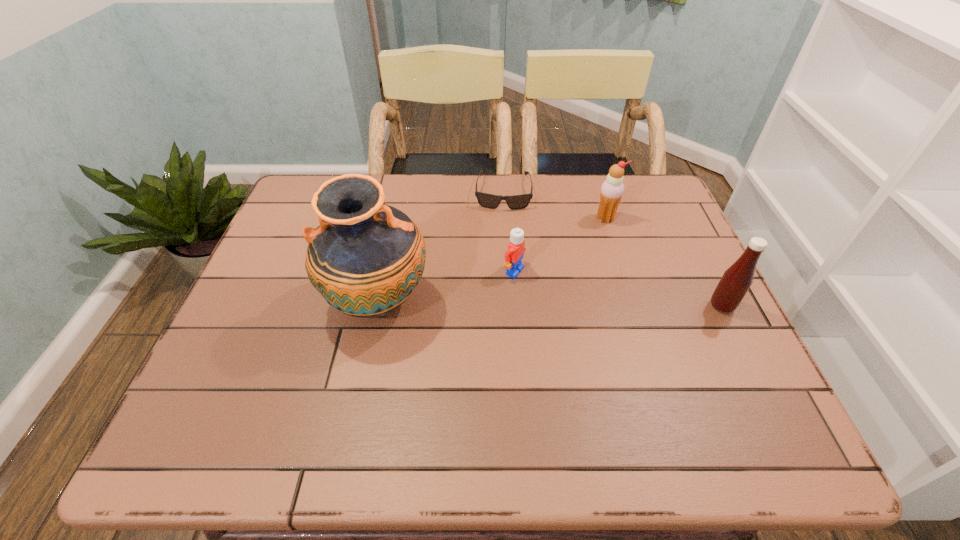
Locate an element on the screen. This screenshot has height=540, width=960. free location located 0.190m at the front with a straw on the second farthest object is located at coordinates (601, 270).

Where is `vacant space located at the front with a straw on the second farthest object`? vacant space located at the front with a straw on the second farthest object is located at coordinates (597, 314).

What are the coordinates of `vacant space positioned at the front with a straw on the second farthest object` in the screenshot? It's located at click(x=603, y=250).

Find the location of `vacant area situated 0.320m on the face of the Lego`. vacant area situated 0.320m on the face of the Lego is located at coordinates (648, 330).

Locate an element on the screen. The height and width of the screenshot is (540, 960). free space located on the face of the Lego is located at coordinates (661, 335).

The height and width of the screenshot is (540, 960). What are the coordinates of `vacant region located 0.250m on the face of the Lego` in the screenshot? It's located at [x=618, y=317].

This screenshot has height=540, width=960. Find the location of `free space located 0.240m on the front-facing side of the sunglasses`. free space located 0.240m on the front-facing side of the sunglasses is located at coordinates (500, 267).

You are a GUI agent. You are given a task and a screenshot of the screen. Output one action in this format:
    pyautogui.click(x=<x>, y=<y>)
    Task: Click on the vacant space located on the front-facing side of the sunglasses
    The image size is (960, 540).
    Given the screenshot: What is the action you would take?
    pyautogui.click(x=497, y=315)

This screenshot has width=960, height=540. In order to click on free location located on the front-facing side of the sunglasses in this screenshot , I will do `click(499, 290)`.

This screenshot has width=960, height=540. I want to click on icecream at the far edge, so click(x=612, y=189).